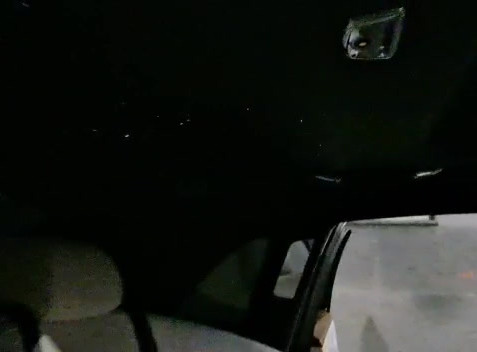
Identify the location of paint. (471, 277).